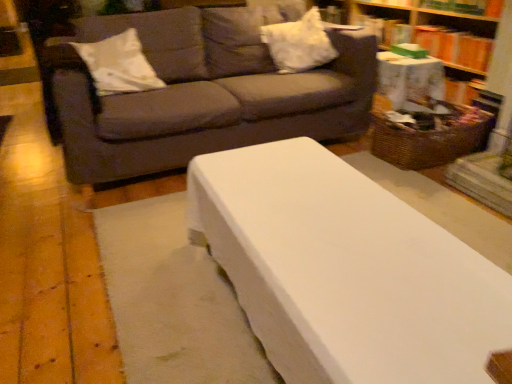
Question: Can you confirm if white fabric pillow at upper center, the first pillow from the right, is taller than woven brown basket at right?

Choices:
 (A) no
 (B) yes

Answer: (B)

Question: From a real-world perspective, is white fabric pillow at upper center, the first pillow from the right, on woven brown basket at right?

Choices:
 (A) yes
 (B) no

Answer: (A)

Question: Can you confirm if white fabric pillow at upper center, the 2th pillow when ordered from left to right, is bigger than woven brown basket at right?

Choices:
 (A) no
 (B) yes

Answer: (A)

Question: Is woven brown basket at right at the back of white fabric pillow at upper center, the first pillow from the right?

Choices:
 (A) yes
 (B) no

Answer: (B)

Question: Is white fabric pillow at upper center, the first pillow from the right, further to camera compared to woven brown basket at right?

Choices:
 (A) yes
 (B) no

Answer: (A)

Question: Is white fabric pillow at upper center, the first pillow from the right, not near woven brown basket at right?

Choices:
 (A) no
 (B) yes

Answer: (A)

Question: Is woven brown basket at right taller than dark gray fabric couch at upper center?

Choices:
 (A) no
 (B) yes

Answer: (A)

Question: Is woven brown basket at right positioned with its back to dark gray fabric couch at upper center?

Choices:
 (A) yes
 (B) no

Answer: (B)

Question: Is dark gray fabric couch at upper center located within woven brown basket at right?

Choices:
 (A) yes
 (B) no

Answer: (B)

Question: Is woven brown basket at right bigger than dark gray fabric couch at upper center?

Choices:
 (A) yes
 (B) no

Answer: (B)

Question: Is woven brown basket at right completely or partially outside of dark gray fabric couch at upper center?

Choices:
 (A) no
 (B) yes

Answer: (B)

Question: Is woven brown basket at right not near dark gray fabric couch at upper center?

Choices:
 (A) no
 (B) yes

Answer: (A)

Question: Can you confirm if orange cardboard book at upper right is taller than white fabric pillow at upper center, the 2th pillow when ordered from left to right?

Choices:
 (A) no
 (B) yes

Answer: (A)